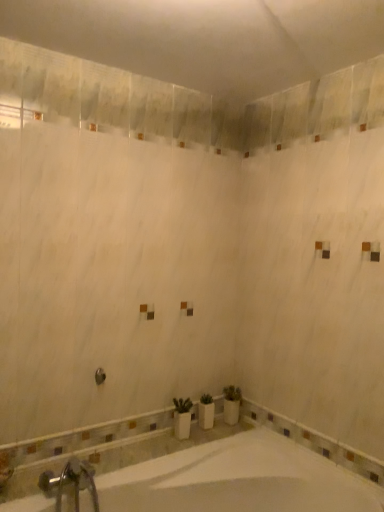
Question: Is white glossy bathtub at lower center at the right side of brushed metal showerhead at center?

Choices:
 (A) no
 (B) yes

Answer: (B)

Question: Can you confirm if white glossy bathtub at lower center is wider than brushed metal showerhead at center?

Choices:
 (A) no
 (B) yes

Answer: (B)

Question: Is white glossy bathtub at lower center far away from brushed metal showerhead at center?

Choices:
 (A) yes
 (B) no

Answer: (B)

Question: Is white glossy bathtub at lower center positioned with its back to brushed metal showerhead at center?

Choices:
 (A) no
 (B) yes

Answer: (A)

Question: Is white glossy bathtub at lower center outside brushed metal showerhead at center?

Choices:
 (A) yes
 (B) no

Answer: (A)

Question: From the image's perspective, is white glossy bathtub at lower center on top of brushed metal showerhead at center?

Choices:
 (A) yes
 (B) no

Answer: (B)

Question: Is brushed metal showerhead at center completely or partially outside of white glossy bathtub at lower center?

Choices:
 (A) no
 (B) yes

Answer: (B)

Question: Does brushed metal showerhead at center appear on the left side of white glossy bathtub at lower center?

Choices:
 (A) no
 (B) yes

Answer: (B)

Question: Does brushed metal showerhead at center lie behind white glossy bathtub at lower center?

Choices:
 (A) no
 (B) yes

Answer: (B)

Question: Considering the relative sizes of brushed metal showerhead at center and white glossy bathtub at lower center in the image provided, is brushed metal showerhead at center thinner than white glossy bathtub at lower center?

Choices:
 (A) yes
 (B) no

Answer: (A)

Question: Is brushed metal showerhead at center far away from white glossy bathtub at lower center?

Choices:
 (A) yes
 (B) no

Answer: (B)

Question: Does brushed metal showerhead at center have a larger size compared to white glossy bathtub at lower center?

Choices:
 (A) yes
 (B) no

Answer: (B)

Question: Does silver metallic faucet at lower left come behind white glossy bathtub at lower center?

Choices:
 (A) yes
 (B) no

Answer: (A)